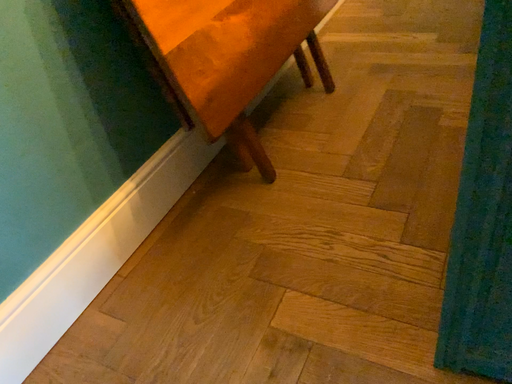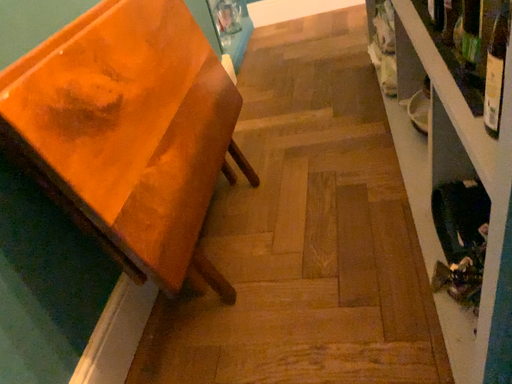
Question: Which way did the camera rotate in the video?

Choices:
 (A) rotated left
 (B) rotated right

Answer: (B)